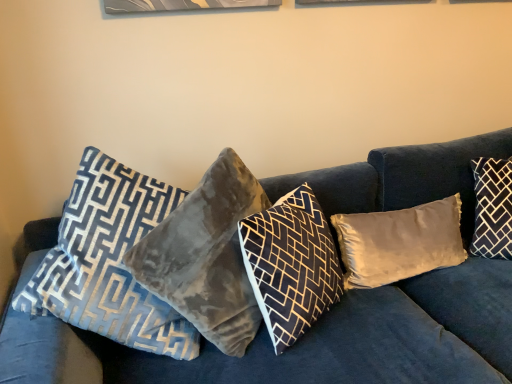
You are a GUI agent. You are given a task and a screenshot of the screen. Output one action in this format:
    pyautogui.click(x=<x>, y=<y>)
    Task: Click on the velvet blue pillow at left, which is the 5th pillow in right-to-left order
    
    Given the screenshot: What is the action you would take?
    pyautogui.click(x=109, y=261)

Describe the element at coordinates (312, 341) in the screenshot. The image size is (512, 384). I see `velvet blue couch at center` at that location.

Image resolution: width=512 pixels, height=384 pixels. Describe the element at coordinates (492, 208) in the screenshot. I see `dark gray velvet pillow at right, the first pillow in the right-to-left sequence` at that location.

Identify the location of dark gray velvet pillow at right, the 5th pillow in the left-to-right sequence. The height and width of the screenshot is (384, 512). (492, 208).

How much space does velvet gray pillow at center, positioned as the 4th pillow in right-to-left order, occupy vertically?

velvet gray pillow at center, positioned as the 4th pillow in right-to-left order, is 20.72 inches in height.

The image size is (512, 384). Describe the element at coordinates (399, 242) in the screenshot. I see `satin beige pillow at center, which is counted as the 2th pillow, starting from the right` at that location.

The height and width of the screenshot is (384, 512). Find the location of `velvet blue pillow at left, which appears as the first pillow when viewed from the left`. velvet blue pillow at left, which appears as the first pillow when viewed from the left is located at coordinates (109, 261).

From a real-world perspective, is satin beige pillow at center, which appears as the fourth pillow when viewed from the left, under velvet blue couch at center?

No, from a real-world perspective, satin beige pillow at center, which appears as the fourth pillow when viewed from the left, is not beneath velvet blue couch at center.

Based on their sizes in the image, would you say satin beige pillow at center, which appears as the fourth pillow when viewed from the left, is bigger or smaller than velvet blue couch at center?

In the image, satin beige pillow at center, which appears as the fourth pillow when viewed from the left, appears to be smaller than velvet blue couch at center.

Considering their positions, is satin beige pillow at center, which appears as the fourth pillow when viewed from the left, located in front of or behind velvet blue couch at center?

In the image, satin beige pillow at center, which appears as the fourth pillow when viewed from the left, appears behind velvet blue couch at center.

What's the angular difference between satin beige pillow at center, which appears as the fourth pillow when viewed from the left, and velvet blue couch at center's facing directions?

There is a 0.734-degree angle between the facing directions of satin beige pillow at center, which appears as the fourth pillow when viewed from the left, and velvet blue couch at center.

Between point (434, 205) and point (222, 151), which one is positioned in front?

The point (222, 151) is more forward.

Would you consider satin beige pillow at center, which is counted as the 2th pillow, starting from the right, to be distant from velvet gray pillow at center, positioned as the 4th pillow in right-to-left order?

That's not correct — satin beige pillow at center, which is counted as the 2th pillow, starting from the right, is a little close to velvet gray pillow at center, positioned as the 4th pillow in right-to-left order.

The height and width of the screenshot is (384, 512). Find the location of `the 1st pillow positioned below the velvet gray pillow at center, positioned as the 4th pillow in right-to-left order (from the image's perspective)`. the 1st pillow positioned below the velvet gray pillow at center, positioned as the 4th pillow in right-to-left order (from the image's perspective) is located at coordinates (399, 242).

Is the position of satin beige pillow at center, which appears as the fourth pillow when viewed from the left, less distant than that of velvet gray pillow at center, acting as the 2th pillow starting from the left?

No, satin beige pillow at center, which appears as the fourth pillow when viewed from the left, is behind velvet gray pillow at center, acting as the 2th pillow starting from the left.

Are dark gray velvet pillow at right, the 5th pillow in the left-to-right sequence, and velvet gray pillow at center, the 3th pillow viewed from the left, far apart?

dark gray velvet pillow at right, the 5th pillow in the left-to-right sequence, is near velvet gray pillow at center, the 3th pillow viewed from the left, not far away.

Is dark gray velvet pillow at right, the 5th pillow in the left-to-right sequence, thinner than velvet gray pillow at center, the 3th pillow viewed from the left?

Yes, dark gray velvet pillow at right, the 5th pillow in the left-to-right sequence, is thinner than velvet gray pillow at center, the 3th pillow viewed from the left.

Which is in front, point (475, 236) or point (316, 278)?

The point (316, 278) is closer.

From their relative heights in the image, would you say dark gray velvet pillow at right, the 5th pillow in the left-to-right sequence, is taller or shorter than velvet gray pillow at center, the 3th pillow viewed from the left?

In the image, dark gray velvet pillow at right, the 5th pillow in the left-to-right sequence, appears to be shorter than velvet gray pillow at center, the 3th pillow viewed from the left.

Is point (352, 284) less distant than point (295, 305)?

That is False.

Based on their positions, is satin beige pillow at center, which is counted as the 2th pillow, starting from the right, located to the left or right of velvet gray pillow at center, the 3th pillow viewed from the right?

satin beige pillow at center, which is counted as the 2th pillow, starting from the right, is positioned on velvet gray pillow at center, the 3th pillow viewed from the right,'s right side.

From a real-world perspective, is satin beige pillow at center, which appears as the fourth pillow when viewed from the left, below velvet gray pillow at center, the 3th pillow viewed from the right?

Correct, in the physical world, satin beige pillow at center, which appears as the fourth pillow when viewed from the left, is lower than velvet gray pillow at center, the 3th pillow viewed from the right.

Looking at this image, can you confirm if satin beige pillow at center, which is counted as the 2th pillow, starting from the right, is shorter than velvet gray pillow at center, the 3th pillow viewed from the right?

Yes, satin beige pillow at center, which is counted as the 2th pillow, starting from the right, is shorter than velvet gray pillow at center, the 3th pillow viewed from the right.

Does velvet blue couch at center contain velvet gray pillow at center, the 3th pillow viewed from the right?

Yes, velvet gray pillow at center, the 3th pillow viewed from the right, is a part of velvet blue couch at center.

Is velvet gray pillow at center, the 3th pillow viewed from the left, at the back of velvet blue couch at center?

Yes, velvet blue couch at center is positioned with its back facing velvet gray pillow at center, the 3th pillow viewed from the left.

How much distance is there between velvet blue couch at center and velvet gray pillow at center, the 3th pillow viewed from the right?

velvet blue couch at center is 9.73 inches away from velvet gray pillow at center, the 3th pillow viewed from the right.

Which is more to the left, velvet blue couch at center or velvet gray pillow at center, the 3th pillow viewed from the right?

velvet gray pillow at center, the 3th pillow viewed from the right.

From a real-world perspective, is velvet blue couch at center physically located above or below satin beige pillow at center, which is counted as the 2th pillow, starting from the right?

Clearly, from a real-world perspective, velvet blue couch at center is below satin beige pillow at center, which is counted as the 2th pillow, starting from the right.

Could you tell me if velvet blue couch at center is facing satin beige pillow at center, which appears as the fourth pillow when viewed from the left?

Yes, velvet blue couch at center is facing satin beige pillow at center, which appears as the fourth pillow when viewed from the left.

Considering the sizes of objects velvet blue couch at center and satin beige pillow at center, which is counted as the 2th pillow, starting from the right, in the image provided, who is taller, velvet blue couch at center or satin beige pillow at center, which is counted as the 2th pillow, starting from the right,?

With more height is velvet blue couch at center.

Can you confirm if velvet blue couch at center is wider than satin beige pillow at center, which is counted as the 2th pillow, starting from the right?

Correct, the width of velvet blue couch at center exceeds that of satin beige pillow at center, which is counted as the 2th pillow, starting from the right.

Is velvet gray pillow at center, the 3th pillow viewed from the left, taller or shorter than satin beige pillow at center, which is counted as the 2th pillow, starting from the right?

velvet gray pillow at center, the 3th pillow viewed from the left, is taller than satin beige pillow at center, which is counted as the 2th pillow, starting from the right.

Considering the positions of objects velvet gray pillow at center, the 3th pillow viewed from the right, and satin beige pillow at center, which appears as the fourth pillow when viewed from the left, in the image provided, who is behind, velvet gray pillow at center, the 3th pillow viewed from the right, or satin beige pillow at center, which appears as the fourth pillow when viewed from the left,?

satin beige pillow at center, which appears as the fourth pillow when viewed from the left.

Could you measure the distance between velvet gray pillow at center, the 3th pillow viewed from the right, and satin beige pillow at center, which appears as the fourth pillow when viewed from the left?

A distance of 31.08 centimeters exists between velvet gray pillow at center, the 3th pillow viewed from the right, and satin beige pillow at center, which appears as the fourth pillow when viewed from the left.

Which object is thinner, velvet gray pillow at center, the 3th pillow viewed from the right, or satin beige pillow at center, which is counted as the 2th pillow, starting from the right?

With smaller width is satin beige pillow at center, which is counted as the 2th pillow, starting from the right.

Where is `studio couch lying on the left of satin beige pillow at center, which appears as the fourth pillow when viewed from the left`? studio couch lying on the left of satin beige pillow at center, which appears as the fourth pillow when viewed from the left is located at coordinates (312, 341).

What are the coordinates of `the 3rd pillow directly beneath the velvet gray pillow at center, acting as the 2th pillow starting from the left (from a real-world perspective)` in the screenshot? It's located at (399, 242).

When comparing their distances from velvet gray pillow at center, acting as the 2th pillow starting from the left, does dark gray velvet pillow at right, the first pillow in the right-to-left sequence, or satin beige pillow at center, which is counted as the 2th pillow, starting from the right, seem further?

dark gray velvet pillow at right, the first pillow in the right-to-left sequence.

Based on their spatial positions, is dark gray velvet pillow at right, the 5th pillow in the left-to-right sequence, or satin beige pillow at center, which is counted as the 2th pillow, starting from the right, further from velvet blue pillow at left, which is the 5th pillow in right-to-left order?

dark gray velvet pillow at right, the 5th pillow in the left-to-right sequence, is positioned further to the anchor velvet blue pillow at left, which is the 5th pillow in right-to-left order.

Estimate the real-world distances between objects in this image. Which object is closer to velvet gray pillow at center, positioned as the 4th pillow in right-to-left order, velvet blue pillow at left, which appears as the first pillow when viewed from the left, or satin beige pillow at center, which is counted as the 2th pillow, starting from the right?

velvet blue pillow at left, which appears as the first pillow when viewed from the left, is positioned closer to the anchor velvet gray pillow at center, positioned as the 4th pillow in right-to-left order.

From the image, which object appears to be nearer to satin beige pillow at center, which is counted as the 2th pillow, starting from the right, velvet blue pillow at left, which appears as the first pillow when viewed from the left, or velvet gray pillow at center, the 3th pillow viewed from the right?

velvet gray pillow at center, the 3th pillow viewed from the right, is closer to satin beige pillow at center, which is counted as the 2th pillow, starting from the right.

Which object lies nearer to the anchor point dark gray velvet pillow at right, the first pillow in the right-to-left sequence, velvet gray pillow at center, positioned as the 4th pillow in right-to-left order, or velvet blue pillow at left, which is the 5th pillow in right-to-left order?

Among the two, velvet gray pillow at center, positioned as the 4th pillow in right-to-left order, is located nearer to dark gray velvet pillow at right, the first pillow in the right-to-left sequence.

From the image, which object appears to be nearer to velvet gray pillow at center, positioned as the 4th pillow in right-to-left order, velvet blue couch at center or satin beige pillow at center, which appears as the fourth pillow when viewed from the left?

velvet blue couch at center is positioned closer to the anchor velvet gray pillow at center, positioned as the 4th pillow in right-to-left order.

Based on their spatial positions, is velvet blue pillow at left, which appears as the first pillow when viewed from the left, or satin beige pillow at center, which is counted as the 2th pillow, starting from the right, closer to velvet gray pillow at center, the 3th pillow viewed from the right?

The object closer to velvet gray pillow at center, the 3th pillow viewed from the right, is satin beige pillow at center, which is counted as the 2th pillow, starting from the right.

Which object lies further to the anchor point velvet gray pillow at center, the 3th pillow viewed from the left, satin beige pillow at center, which is counted as the 2th pillow, starting from the right, or velvet blue couch at center?

satin beige pillow at center, which is counted as the 2th pillow, starting from the right, is positioned further to the anchor velvet gray pillow at center, the 3th pillow viewed from the left.

What are the coordinates of `pillow between velvet gray pillow at center, the 3th pillow viewed from the left, and dark gray velvet pillow at right, the 5th pillow in the left-to-right sequence, from left to right` in the screenshot? It's located at (399, 242).

Where is `pillow between velvet gray pillow at center, positioned as the 4th pillow in right-to-left order, and velvet blue couch at center from left to right`? pillow between velvet gray pillow at center, positioned as the 4th pillow in right-to-left order, and velvet blue couch at center from left to right is located at coordinates (291, 265).

The image size is (512, 384). What are the coordinates of `pillow between velvet blue pillow at left, which is the 5th pillow in right-to-left order, and velvet gray pillow at center, the 3th pillow viewed from the left, from left to right` in the screenshot? It's located at (206, 256).

I want to click on studio couch situated between velvet gray pillow at center, acting as the 2th pillow starting from the left, and dark gray velvet pillow at right, the 5th pillow in the left-to-right sequence, from left to right, so click(312, 341).